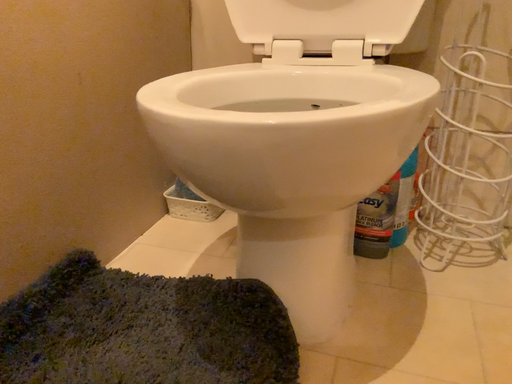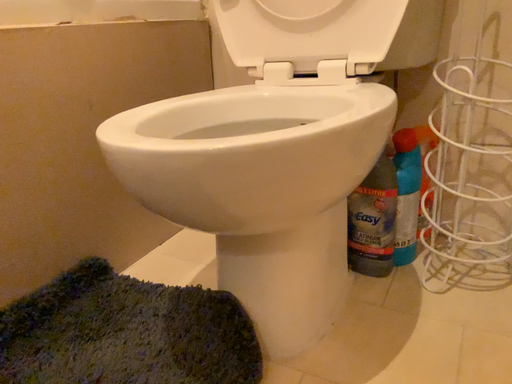
Question: How did the camera likely rotate when shooting the video?

Choices:
 (A) rotated right
 (B) rotated left

Answer: (B)